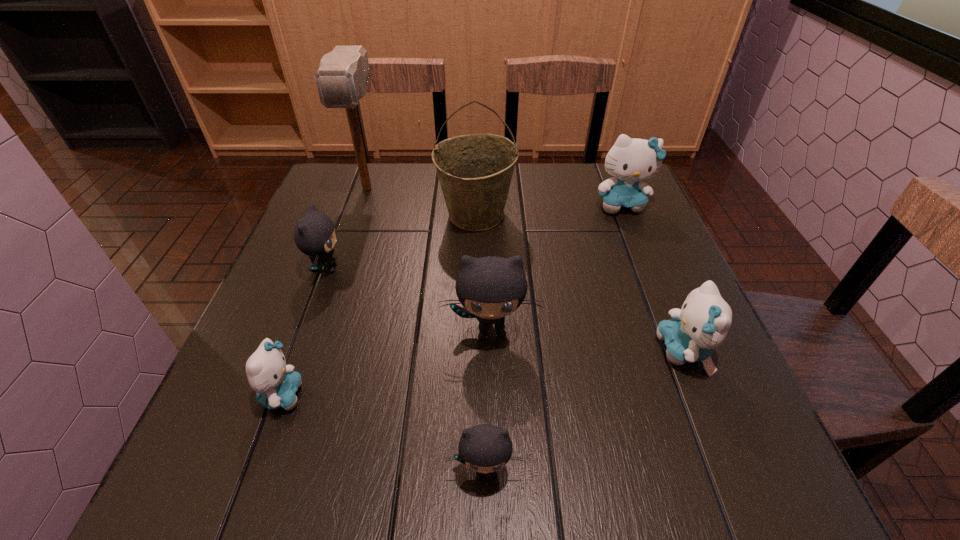
This screenshot has height=540, width=960. Find the location of `vacant area between the farthest gray kitten and the biggest blue kitten`. vacant area between the farthest gray kitten and the biggest blue kitten is located at coordinates pos(474,236).

You are a GUI agent. You are given a task and a screenshot of the screen. Output one action in this format:
    pyautogui.click(x=<x>, y=<y>)
    Task: Click on the vacant area that lies between the farthest gray kitten and the wine bucket
    The image size is (960, 540).
    Given the screenshot: What is the action you would take?
    pyautogui.click(x=401, y=241)

This screenshot has width=960, height=540. I want to click on free area in between the second biggest blue kitten and the seventh shortest object, so click(x=580, y=282).

Image resolution: width=960 pixels, height=540 pixels. I want to click on object that is the fourth closest to the leftmost blue kitten, so click(x=475, y=171).

This screenshot has height=540, width=960. What are the coordinates of `object that is the seventh nearest to the leftmost blue kitten` in the screenshot? It's located at (630, 161).

Locate an element on the screen. kitten that is the fifth closest to the fifth nearest kitten is located at coordinates (703, 322).

Locate an element on the screen. kitten that is the fifth closest one to the mallet is located at coordinates (484, 448).

At what (x,y) coordinates should I click in order to perform the action: click on the second closest blue kitten relative to the biggest blue kitten. Please return your answer as a coordinate pair (x, y). Image resolution: width=960 pixels, height=540 pixels. Looking at the image, I should click on (275, 383).

Select which blue kitten is the third closest to the biggest gray kitten. Please provide its 2D coordinates. Your answer should be formatted as a tuple, i.e. [(x, y)], where the tuple contains the x and y coordinates of a point satisfying the conditions above.

[(630, 161)]

You are a GUI agent. You are given a task and a screenshot of the screen. Output one action in this format:
    pyautogui.click(x=<x>, y=<y>)
    Task: Click on the third closest gray kitten to the mallet
    The width and height of the screenshot is (960, 540).
    Given the screenshot: What is the action you would take?
    pyautogui.click(x=484, y=448)